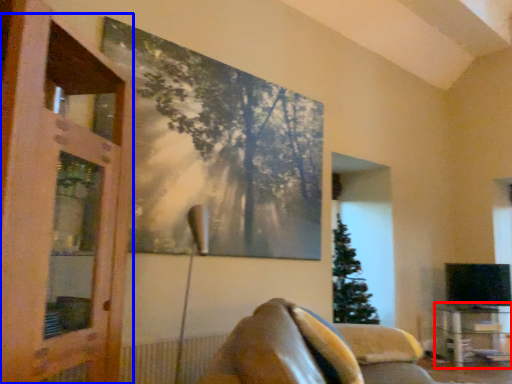
Question: Among these objects, which one is nearest to the camera, table (highlighted by a red box) or screen door (highlighted by a blue box)?

Choices:
 (A) table
 (B) screen door

Answer: (B)